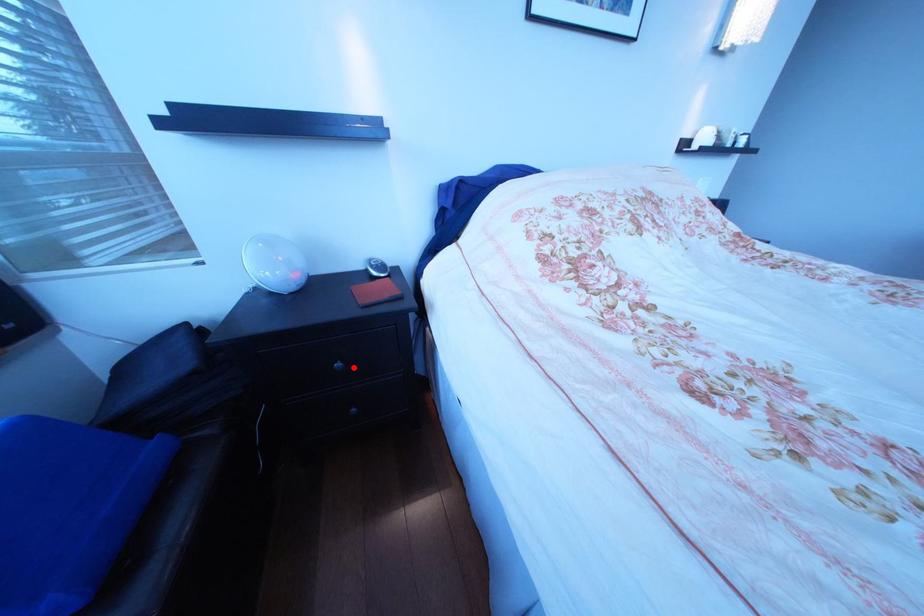
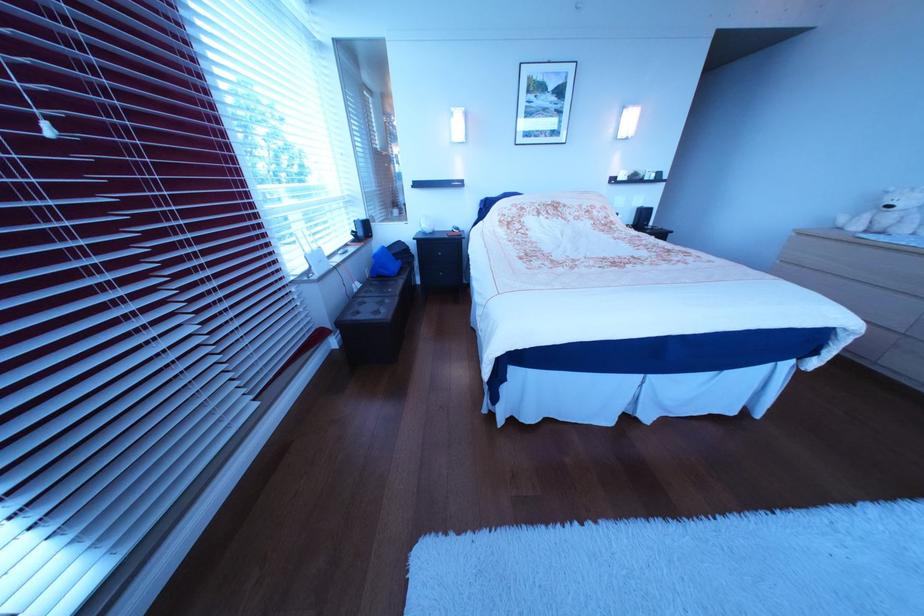
Question: I am providing you with two images of the same scene from different viewpoints. Image1 has a red point marked. In image2, the corresponding 3D location appears at what relative position? Reply with the corresponding letter.

Choices:
 (A) Closer
 (B) Farther

Answer: (A)